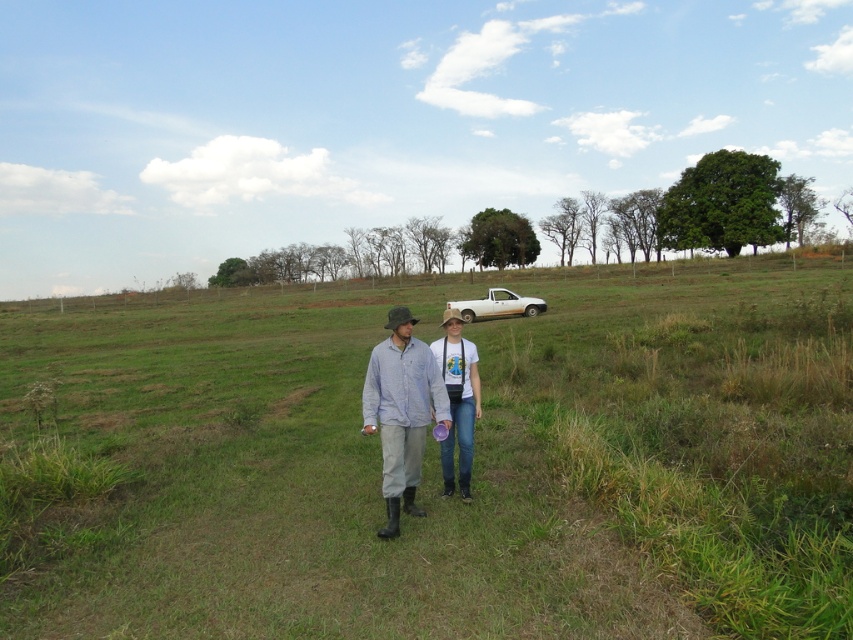
Who is higher up, white cotton t-shirt at center or white matte pickup truck at center?

white matte pickup truck at center is above.

Where is `white cotton t-shirt at center`? white cotton t-shirt at center is located at coordinates (457, 401).

This screenshot has width=853, height=640. Describe the element at coordinates (457, 401) in the screenshot. I see `white cotton t-shirt at center` at that location.

Locate an element on the screen. This screenshot has height=640, width=853. white cotton t-shirt at center is located at coordinates (457, 401).

Is light blue cotton shirt at center positioned behind white matte pickup truck at center?

No.

Does light blue cotton shirt at center have a lesser width compared to white matte pickup truck at center?

Yes.

Find the location of a particular element. This screenshot has width=853, height=640. light blue cotton shirt at center is located at coordinates click(402, 410).

Where is `light blue cotton shirt at center`? The image size is (853, 640). light blue cotton shirt at center is located at coordinates (402, 410).

Which is more to the right, green grass at center or light blue cotton shirt at center?

From the viewer's perspective, green grass at center appears more on the right side.

Is green grass at center above light blue cotton shirt at center?

Correct, green grass at center is located above light blue cotton shirt at center.

Which is behind, point (161, 401) or point (399, 408)?

Point (161, 401)

I want to click on green grass at center, so click(x=438, y=461).